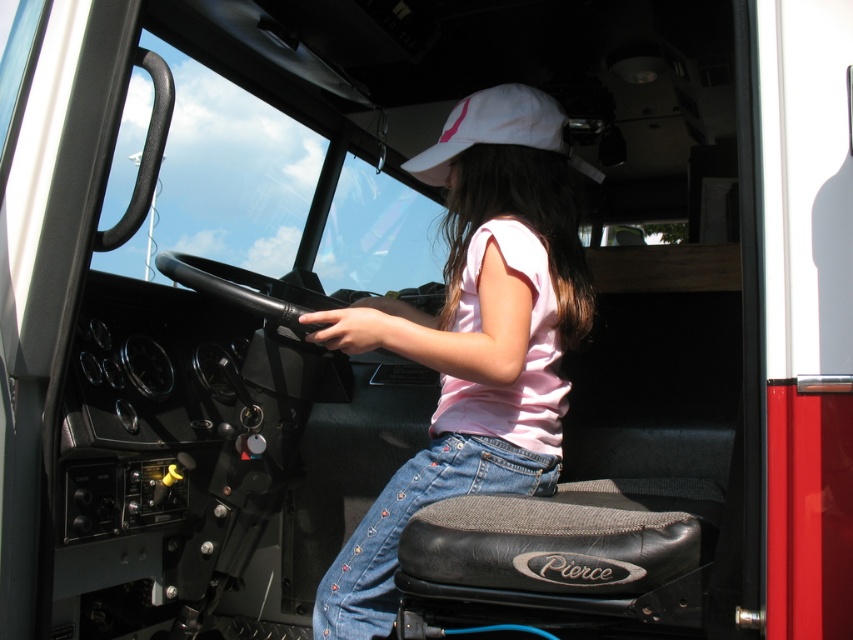
The young girl is sitting in the driver seat of a large vehicle. She has a pink cotton shirt at center and a white fabric baseball cap at upper center. Which item is closer to the dashboard?

The pink cotton shirt at center is closer to the dashboard because it is in front of the white fabric baseball cap at upper center.

You are a technician inspecting the dashboard of the vehicle. You notice two points on the dashboard at coordinates point (573, 202) and point (491, 112). Which point is closer to you?

Point (491, 112) is closer to you because it is less further to the camera than point (573, 202).

You are a safety inspector checking the seating area of a fire truck. The pink cotton shirt at center and white fabric baseball cap at upper center are part of the driver seat setup. According to safety regulations, these items must be at least 12 inches apart to prevent interference during sudden movements. Does the current arrangement comply with the safety standards?

The pink cotton shirt at center is 13.10 inches away from the white fabric baseball cap at upper center. Since 13.10 inches exceeds the minimum required 12 inches, the current arrangement complies with the safety standards.